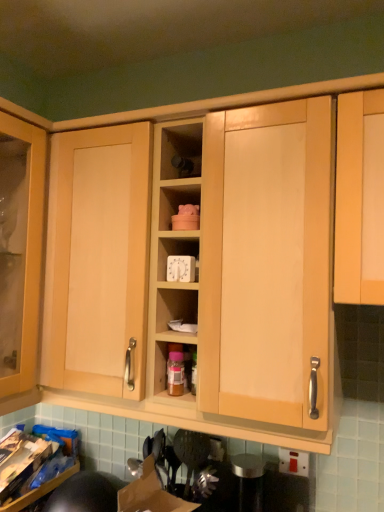
Question: Considering the relative sizes of translucent plastic bottle at center and matte wood shelf at center in the image provided, is translucent plastic bottle at center smaller than matte wood shelf at center?

Choices:
 (A) yes
 (B) no

Answer: (A)

Question: From the image's perspective, does translucent plastic bottle at center appear higher than matte wood shelf at center?

Choices:
 (A) yes
 (B) no

Answer: (B)

Question: From a real-world perspective, is translucent plastic bottle at center positioned under matte wood shelf at center based on gravity?

Choices:
 (A) yes
 (B) no

Answer: (A)

Question: Can you confirm if translucent plastic bottle at center is shorter than matte wood shelf at center?

Choices:
 (A) yes
 (B) no

Answer: (B)

Question: Is matte wood shelf at center at the back of translucent plastic bottle at center?

Choices:
 (A) yes
 (B) no

Answer: (B)

Question: Does point (167, 167) appear closer or farther from the camera than point (180, 368)?

Choices:
 (A) farther
 (B) closer

Answer: (A)

Question: From a real-world perspective, is matte wood shelf at center above or below translucent plastic bottle at center?

Choices:
 (A) above
 (B) below

Answer: (A)

Question: Is matte wood shelf at center bigger or smaller than translucent plastic bottle at center?

Choices:
 (A) big
 (B) small

Answer: (A)

Question: Choose the correct answer: Is matte wood shelf at center inside translucent plastic bottle at center or outside it?

Choices:
 (A) outside
 (B) inside

Answer: (A)

Question: Is white plastic timer at center wider or thinner than translucent plastic bottle at center?

Choices:
 (A) wide
 (B) thin

Answer: (A)

Question: Relative to translucent plastic bottle at center, is white plastic timer at center in front or behind?

Choices:
 (A) behind
 (B) front

Answer: (B)

Question: Is point (162, 258) closer or farther from the camera than point (168, 378)?

Choices:
 (A) closer
 (B) farther

Answer: (B)

Question: Based on their sizes in the image, would you say white plastic timer at center is bigger or smaller than translucent plastic bottle at center?

Choices:
 (A) big
 (B) small

Answer: (A)

Question: Visually, is matte wood shelf at center positioned to the left or to the right of white plastic timer at center?

Choices:
 (A) left
 (B) right

Answer: (B)

Question: Does point (185, 125) appear closer or farther from the camera than point (187, 250)?

Choices:
 (A) closer
 (B) farther

Answer: (A)